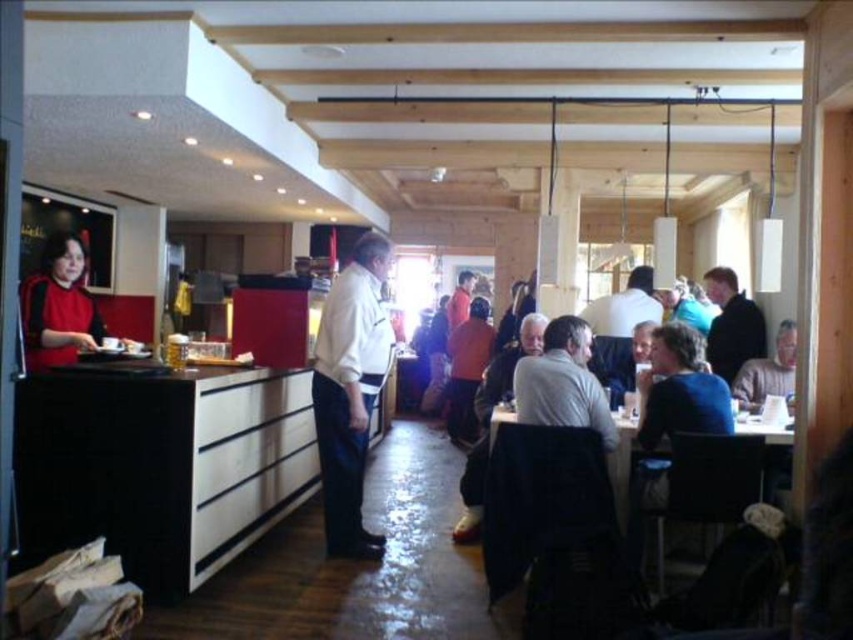
Who is lower down, dark brown leather jacket at upper right or wooden table at center?

wooden table at center is below.

Is point (728, 358) less distant than point (751, 420)?

No, it is not.

Who is more distant from viewer, [741,352] or [628,422]?

Point [741,352]

Identify the location of dark brown leather jacket at upper right. (730, 324).

Is matte red sweater at left wider than dark brown leather jacket at upper right?

No, matte red sweater at left is not wider than dark brown leather jacket at upper right.

At what (x,y) coordinates should I click in order to perform the action: click on matte red sweater at left. Please return your answer as a coordinate pair (x, y). The width and height of the screenshot is (853, 640). Looking at the image, I should click on (57, 307).

The height and width of the screenshot is (640, 853). What are the coordinates of `matte red sweater at left` in the screenshot? It's located at (57, 307).

The width and height of the screenshot is (853, 640). In order to click on dark brown leather jacket at upper right in this screenshot , I will do `click(730, 324)`.

What do you see at coordinates (730, 324) in the screenshot?
I see `dark brown leather jacket at upper right` at bounding box center [730, 324].

Is point (718, 372) closer to camera compared to point (759, 364)?

No.

You are a GUI agent. You are given a task and a screenshot of the screen. Output one action in this format:
    pyautogui.click(x=<x>, y=<y>)
    Task: Click on the dark brown leather jacket at upper right
    Image resolution: width=853 pixels, height=640 pixels.
    Given the screenshot: What is the action you would take?
    pyautogui.click(x=730, y=324)